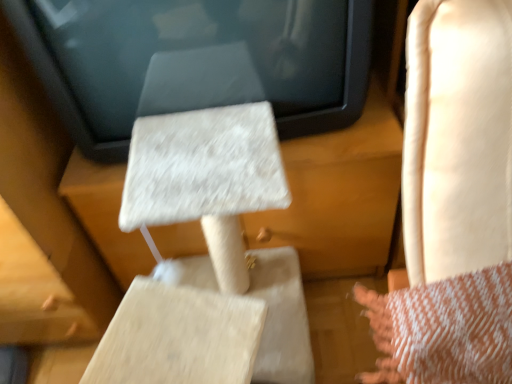
Question: From a real-world perspective, is beige textured cat tree at center physically located above or below light beige leather rocking chair at right?

Choices:
 (A) above
 (B) below

Answer: (B)

Question: In terms of height, does beige textured cat tree at center look taller or shorter compared to light beige leather rocking chair at right?

Choices:
 (A) tall
 (B) short

Answer: (B)

Question: Based on their relative distances, which object is nearer to the white textured cat tree at center?

Choices:
 (A) beige textured cat tree at center
 (B) light beige leather rocking chair at right

Answer: (A)

Question: Which object is the closest to the white textured cat tree at center?

Choices:
 (A) light beige leather rocking chair at right
 (B) beige textured cat tree at center

Answer: (B)